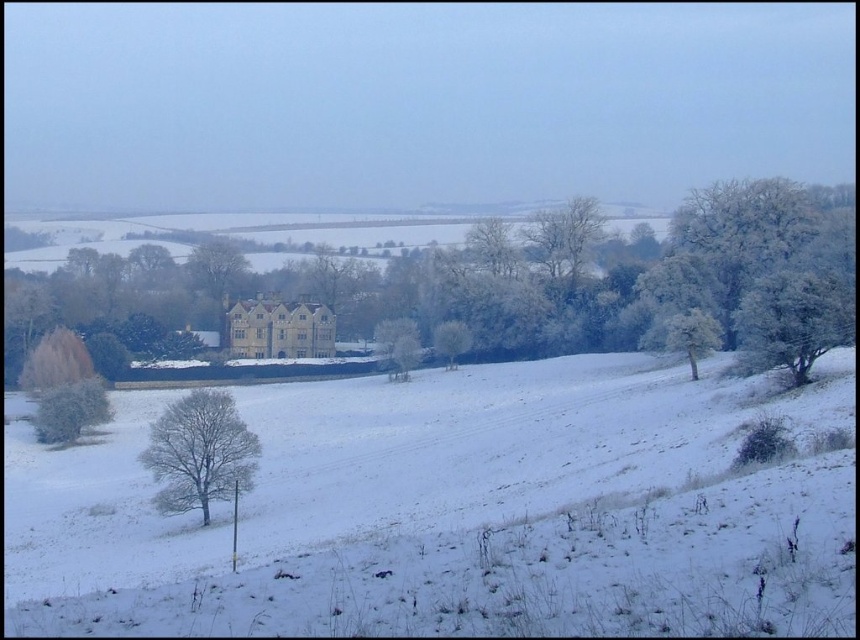
Question: Which object is closer to the camera taking this photo?

Choices:
 (A) white frosty tree at right
 (B) white frosty tree at center

Answer: (A)

Question: From the image, what is the correct spatial relationship of frosted white tree at right in relation to green frosted bush at lower left?

Choices:
 (A) below
 (B) above

Answer: (B)

Question: Is white fluffy snow at center to the left of frosted white tree at right from the viewer's perspective?

Choices:
 (A) yes
 (B) no

Answer: (A)

Question: Which point is farther to the camera?

Choices:
 (A) (108, 397)
 (B) (736, 541)
 (C) (707, 332)

Answer: (A)

Question: Which of the following is the closest to the observer?

Choices:
 (A) green frosted bush at lower left
 (B) white frosty tree at center
 (C) frosted white tree at right

Answer: (C)

Question: Can you confirm if white frosty tree at lower left is positioned to the left of white frosty tree at center?

Choices:
 (A) yes
 (B) no

Answer: (A)